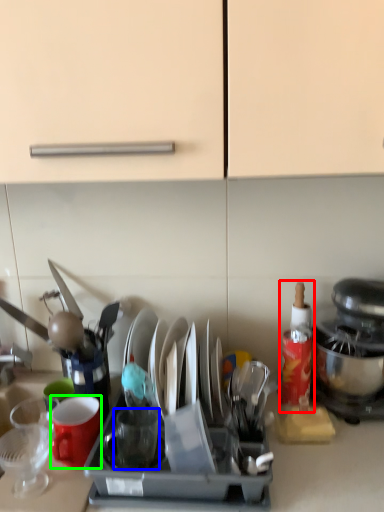
Question: Which is nearer to the bottle (highlighted by a red box)? tableware (highlighted by a blue box) or coffee cup (highlighted by a green box).

Choices:
 (A) tableware
 (B) coffee cup

Answer: (A)